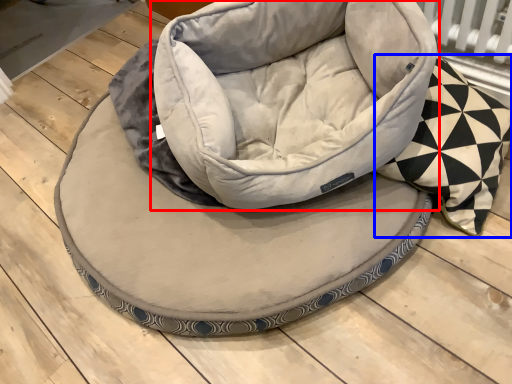
Question: Which of the following is the farthest to the observer, bean bag chair (highlighted by a red box) or throw pillow (highlighted by a blue box)?

Choices:
 (A) bean bag chair
 (B) throw pillow

Answer: (A)